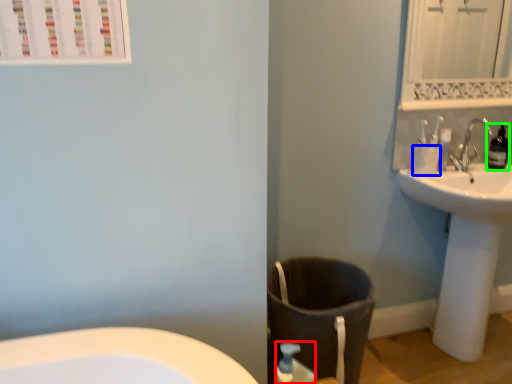
Question: Which object is the closest to the soap dispenser (highlighted by a red box)? Choose among these: toilet paper (highlighted by a blue box) or bottle (highlighted by a green box).

Choices:
 (A) toilet paper
 (B) bottle

Answer: (A)